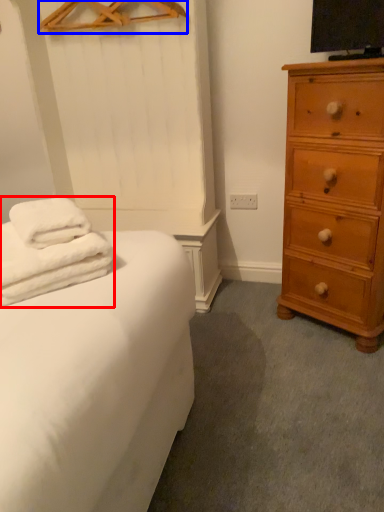
Question: Which point is further to the camera, bath towel (highlighted by a red box) or hanger (highlighted by a blue box)?

Choices:
 (A) bath towel
 (B) hanger

Answer: (B)